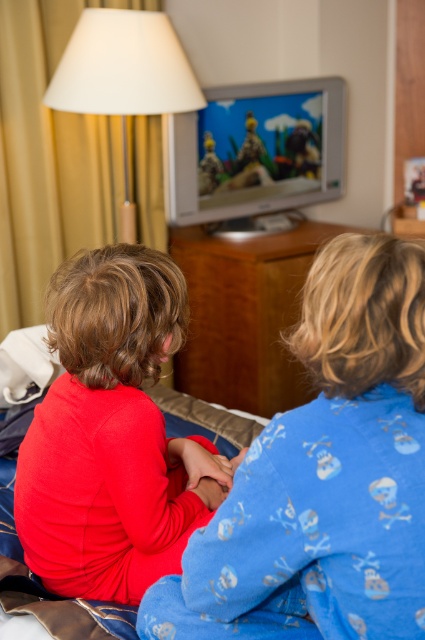
Question: Can you confirm if matte red shirt at center is thinner than brown wood dresser at center?

Choices:
 (A) yes
 (B) no

Answer: (A)

Question: Can you confirm if red fleece shirt at center is positioned to the right of brown wood dresser at center?

Choices:
 (A) yes
 (B) no

Answer: (B)

Question: Which of the following is the farthest from the observer?

Choices:
 (A) (306, 269)
 (B) (127, 296)

Answer: (A)

Question: Which point is farther to the camera?

Choices:
 (A) matte red shirt at center
 (B) brown wood dresser at center

Answer: (B)

Question: Estimate the real-world distances between objects in this image. Which object is farther from the matte red shirt at center?

Choices:
 (A) red fleece shirt at center
 (B) brown wood dresser at center

Answer: (B)

Question: Is red fleece shirt at center closer to the viewer compared to matte red shirt at center?

Choices:
 (A) yes
 (B) no

Answer: (A)